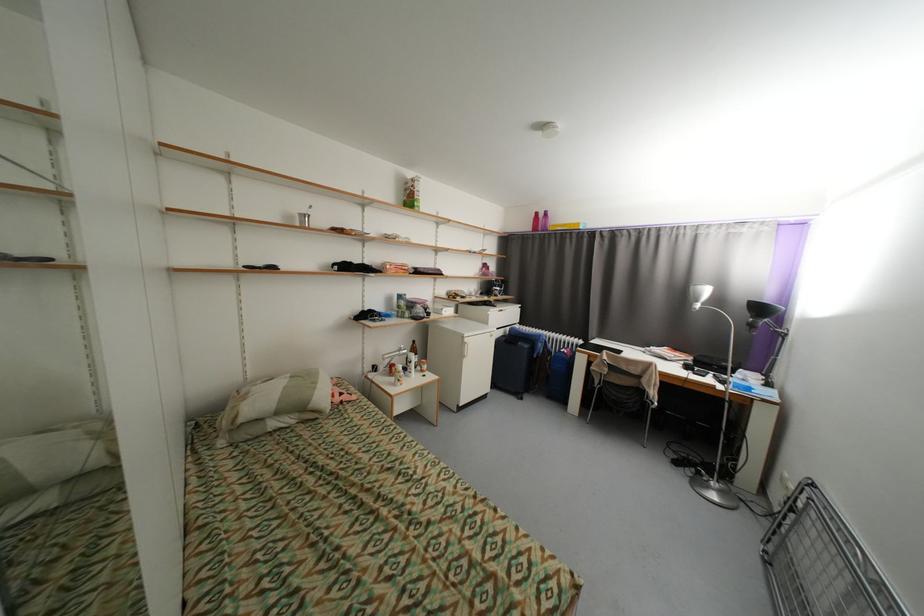
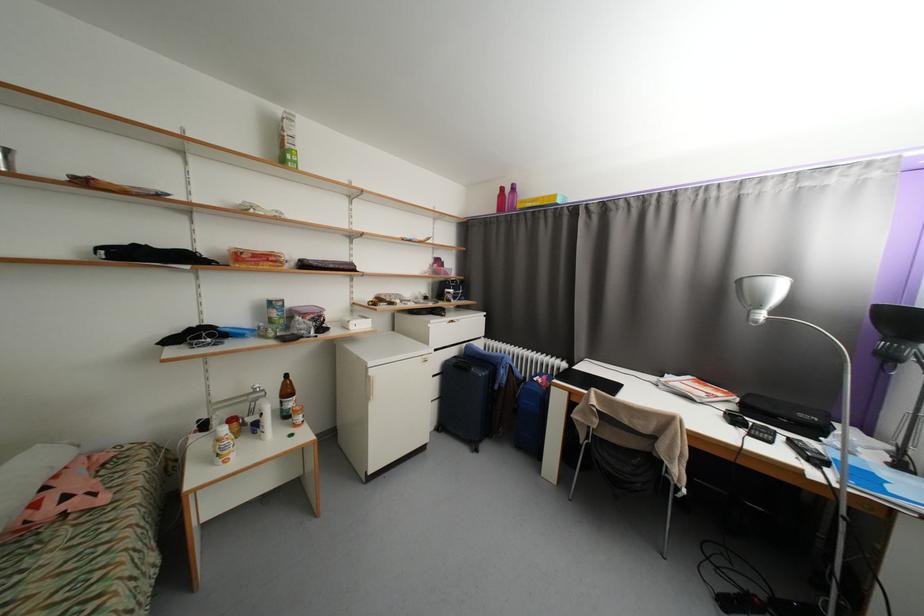
Locate, in the second image, the point that corresponds to point 414,378 in the first image.

(265, 439)